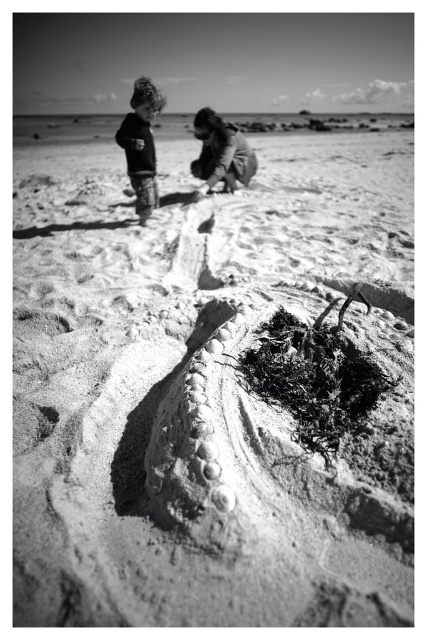
Is matte black jacket at upper left wider than smooth fabric child at upper center?

Incorrect, matte black jacket at upper left's width does not surpass smooth fabric child at upper center's.

Who is more distant from viewer, (146, 97) or (207, 150)?

The point (207, 150) is more distant.

Between point (131, 150) and point (198, 136), which one is positioned in front?

Positioned in front is point (131, 150).

Locate an element on the screen. matte black jacket at upper left is located at coordinates (142, 145).